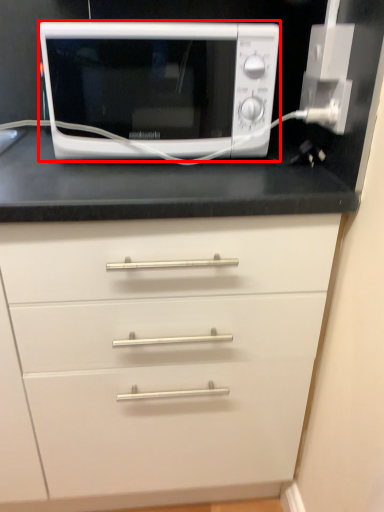
Question: Observing the image, what is the correct spatial positioning of microwave oven (annotated by the red box) in reference to electric outlet?

Choices:
 (A) left
 (B) right

Answer: (A)